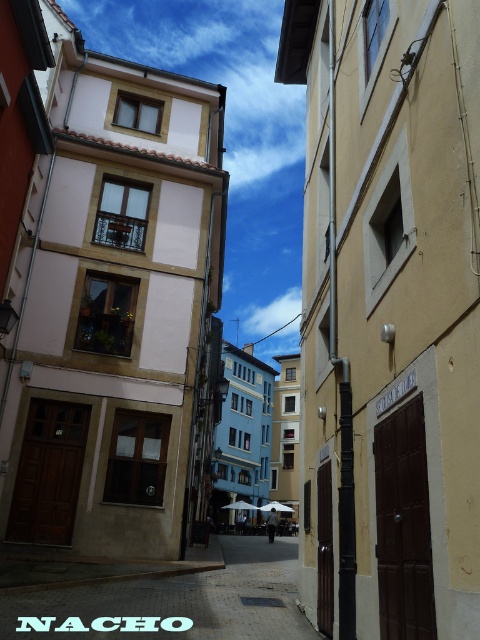
You are a delivery person trying to enter the beige matte door at center right. The entrance requires you to step over the smooth stone alley at center. Can you step over the alley without bending down?

The beige matte door at center right is taller than the smooth stone alley at center, so you can step over the alley without bending down since the door is higher.

You are a delivery person trying to find the correct entrance to a shop located in this narrow street. You see a beige matte door at center right and a smooth stone alley at center. Which object is located to the right of the other?

The beige matte door at center right is positioned on the right side of the smooth stone alley at center.